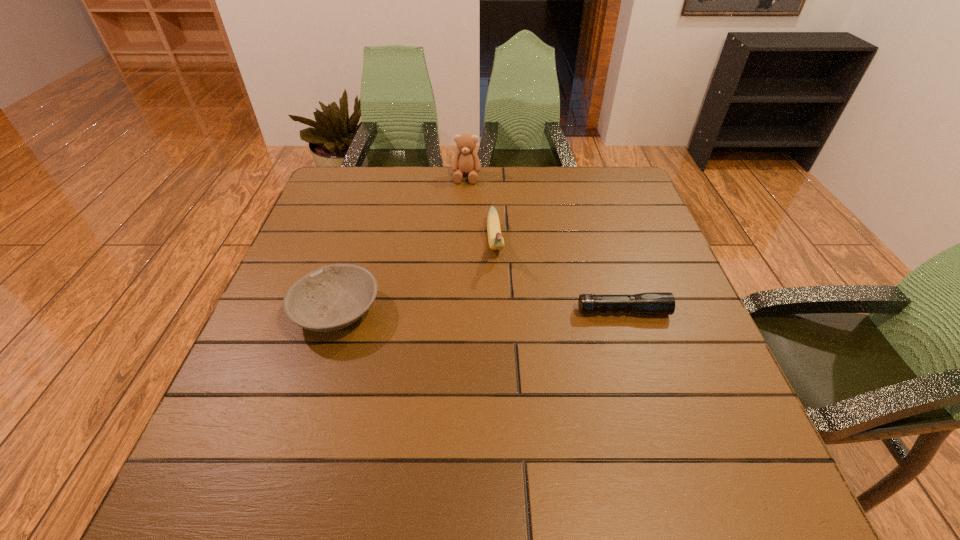
Locate an element on the screen. Image resolution: width=960 pixels, height=540 pixels. free spot on the desktop that is between the second shortest object and the flashlight and is positioned on the face of the third object from right to left is located at coordinates (445, 312).

The height and width of the screenshot is (540, 960). In order to click on vacant spot on the desktop that is between the second shortest object and the shortest object and is positioned at the stem of the second farthest object in this screenshot , I will do `click(504, 312)`.